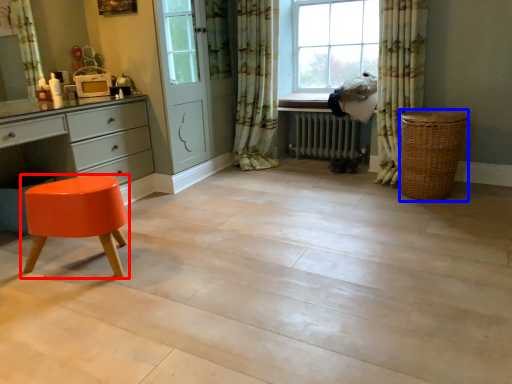
Question: Which object appears farthest to the camera in this image, stool (highlighted by a red box) or basket (highlighted by a blue box)?

Choices:
 (A) stool
 (B) basket

Answer: (B)